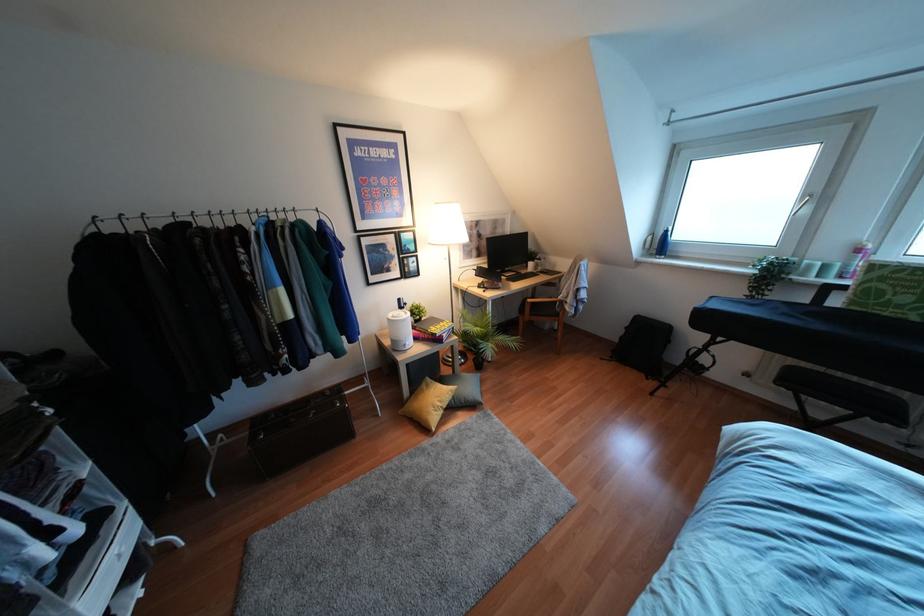
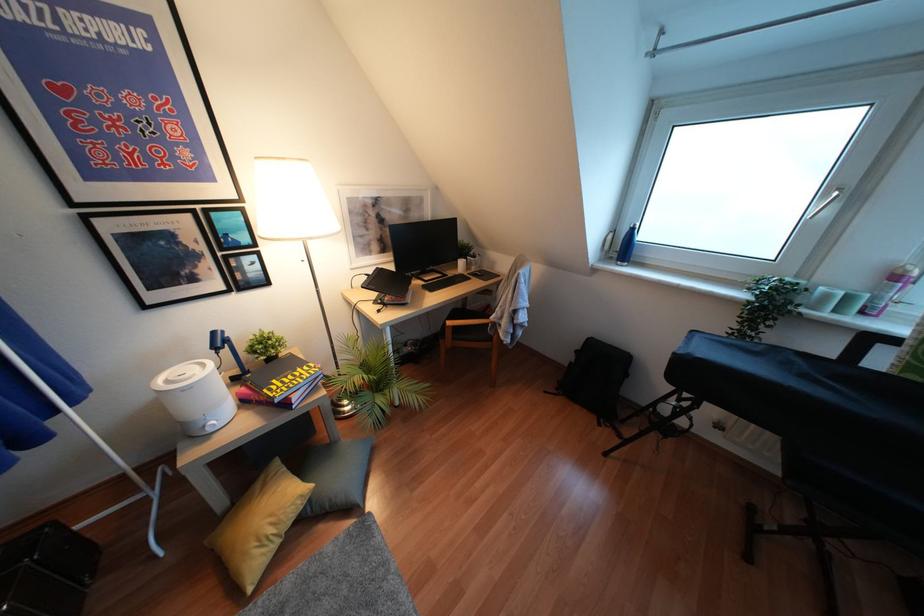
Question: The camera is either moving clockwise (left) or counter-clockwise (right) around the object. The first image is from the beginning of the video and the second image is from the end. Is the camera moving left or right when shooting the video?

Choices:
 (A) Left
 (B) Right

Answer: (A)